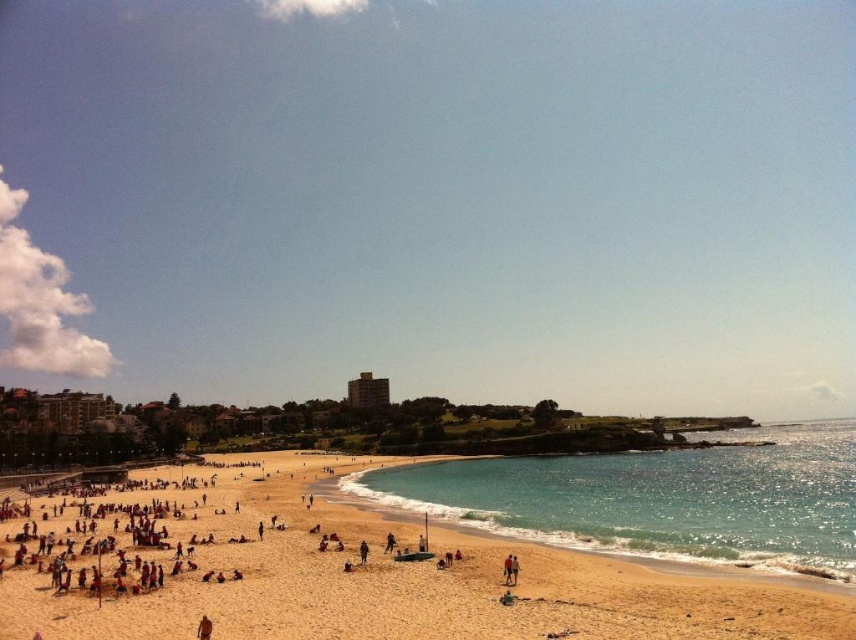
Question: Which point appears closest to the camera in this image?

Choices:
 (A) (236, 154)
 (B) (837, 460)
 (C) (419, 632)

Answer: (C)

Question: Which of these objects is positioned farthest from the clear blue water at center?

Choices:
 (A) golden sand beach at lower left
 (B) blue sky at upper center

Answer: (B)

Question: Which object is farther from the camera taking this photo?

Choices:
 (A) clear blue water at center
 (B) blue sky at upper center
 (C) golden sand beach at lower left

Answer: (B)

Question: Does blue sky at upper center have a lesser width compared to clear blue water at center?

Choices:
 (A) no
 (B) yes

Answer: (A)

Question: Can you confirm if blue sky at upper center is bigger than golden sand beach at lower left?

Choices:
 (A) yes
 (B) no

Answer: (A)

Question: From the image, what is the correct spatial relationship of blue sky at upper center in relation to clear blue water at center?

Choices:
 (A) above
 (B) below

Answer: (A)